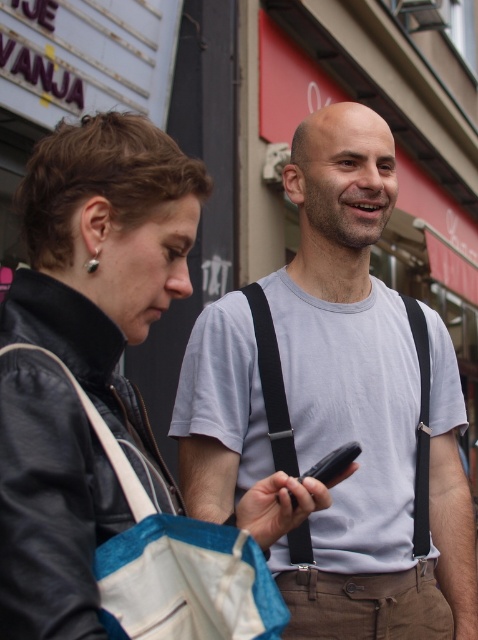
In the scene shown: You are a photographer who needs to take a photo of the gray cotton shirt at center and the camera. The minimum distance required between the two subjects for your camera to focus properly is 7 feet. Can you take the photo without moving either subject?

The gray cotton shirt at center and camera are 7.18 feet apart from each other, which is more than the required 7 feet. Therefore, you can take the photo without moving either subject.

You are a delivery person who needs to place a package on the ground between the blue fabric shopping bag at center and the black matte smartphone at center. Based on their positions, which object should you position the package closer to so it doesn

The blue fabric shopping bag at center is in front of the black matte smartphone at center, so to place the package between them, you should position it closer to the black matte smartphone at center since the shopping bag is in front of the smartphone.

What are the coordinates of the gray cotton shirt at center?

The gray cotton shirt at center is located at coordinates point (365, 406).